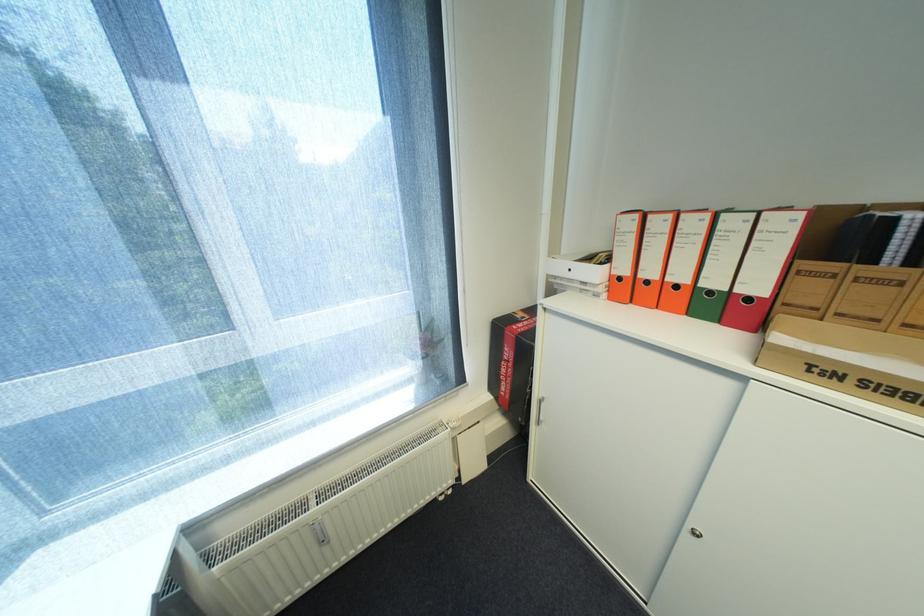
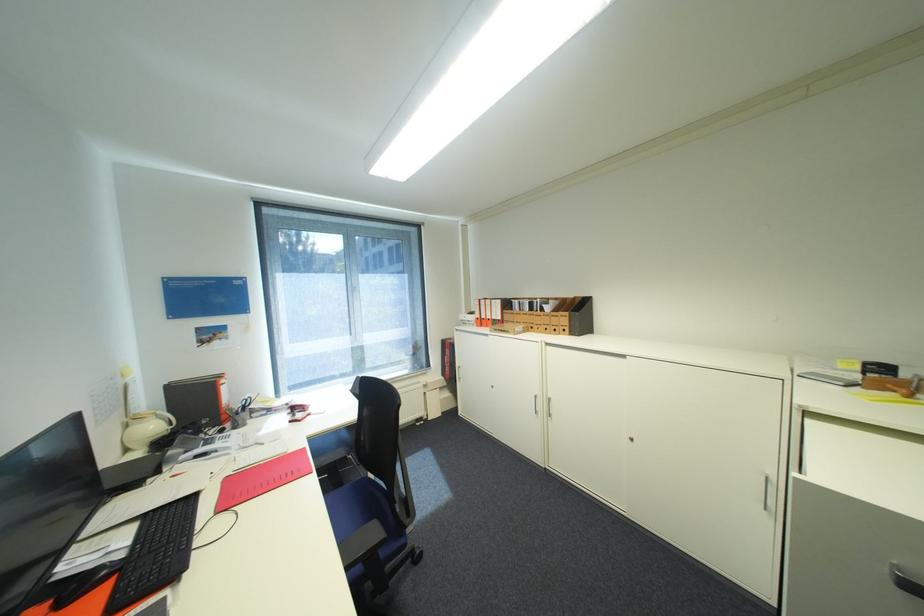
Where in the second image is the point corresponding to the point at 627,278 from the first image?

(485, 318)